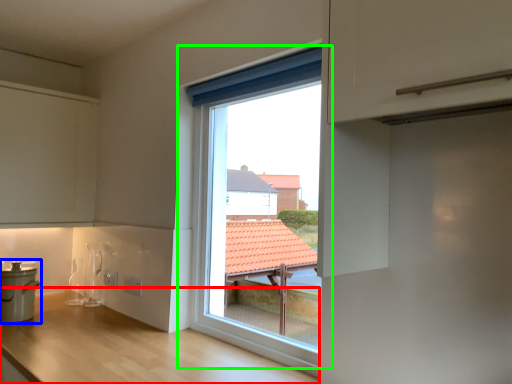
Question: Based on their relative distances, which object is farther from counter (highlighted by a red box)? Choose from cooker (highlighted by a blue box) and window (highlighted by a green box).

Choices:
 (A) cooker
 (B) window

Answer: (B)